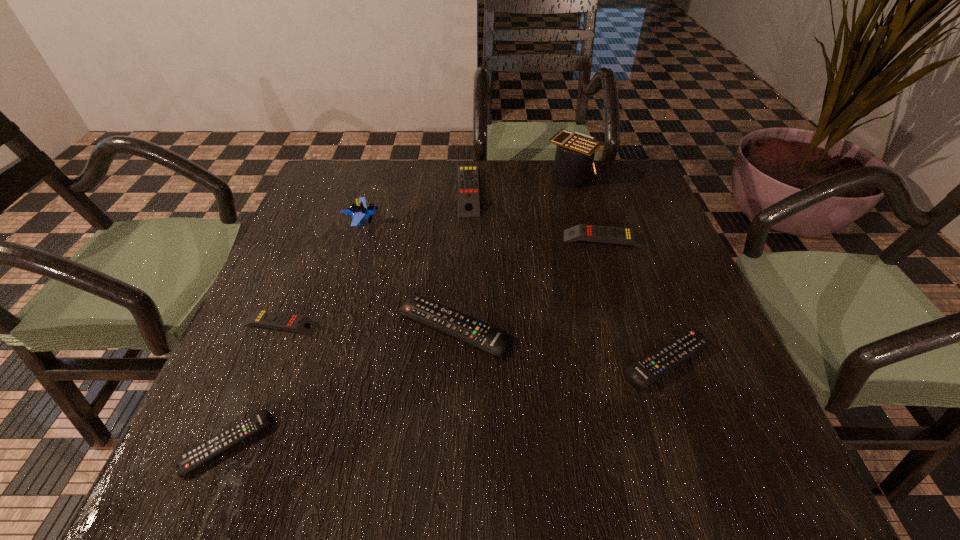
In the image, there is a desktop. At what (x,y) coordinates should I click in order to perform the action: click on vacant space at the far edge. Please return your answer as a coordinate pair (x, y). The image size is (960, 540). Looking at the image, I should click on (507, 167).

You are a GUI agent. You are given a task and a screenshot of the screen. Output one action in this format:
    pyautogui.click(x=<x>, y=<y>)
    Task: Click on the free space at the left edge
    The width and height of the screenshot is (960, 540).
    Given the screenshot: What is the action you would take?
    pyautogui.click(x=320, y=271)

Find the location of a particular element. free location at the right edge is located at coordinates (732, 395).

The height and width of the screenshot is (540, 960). Identify the location of free region at the far left corner of the desktop. (340, 159).

Where is `vacant space at the far right corner of the desktop`? The height and width of the screenshot is (540, 960). vacant space at the far right corner of the desktop is located at coordinates (645, 185).

Identify the location of vacant area at the near right corner of the desktop. The image size is (960, 540). (709, 446).

Find the location of `empty space that is in between the rightmost black remote control and the second black remote control from left to right`. empty space that is in between the rightmost black remote control and the second black remote control from left to right is located at coordinates (561, 345).

Find the location of a particular element. This screenshot has width=960, height=540. free point between the second black remote control from right to left and the nearest object is located at coordinates (340, 386).

Find the location of `vacant space that's between the second smallest black remote control and the calculator`. vacant space that's between the second smallest black remote control and the calculator is located at coordinates (619, 268).

Identify the location of vacant area that lies between the leftmost yellow remote control and the farthest remote control. The height and width of the screenshot is (540, 960). (374, 257).